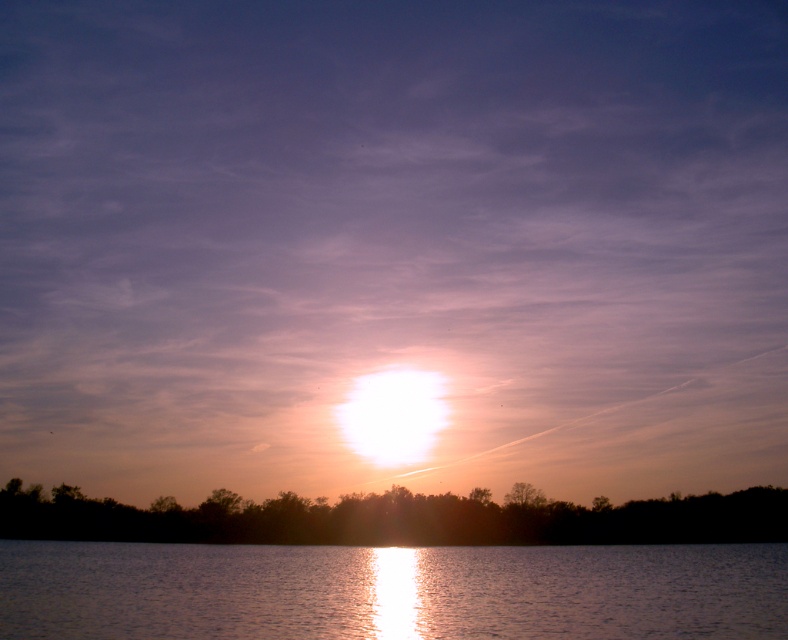
Question: Observing the image, what is the correct spatial positioning of glistening water at center in reference to silky water at lower center?

Choices:
 (A) below
 (B) above

Answer: (B)

Question: Which point is farther to the camera?

Choices:
 (A) (779, 500)
 (B) (712, 608)

Answer: (A)

Question: Which point is closer to the camera?

Choices:
 (A) silky water at lower center
 (B) glistening water at center

Answer: (B)

Question: Does glistening water at center have a lesser width compared to silky water at lower center?

Choices:
 (A) no
 (B) yes

Answer: (B)

Question: Which point is farther to the camera?

Choices:
 (A) silky water at lower center
 (B) glistening water at center

Answer: (A)

Question: Can you confirm if glistening water at center is positioned below silky water at lower center?

Choices:
 (A) yes
 (B) no

Answer: (B)